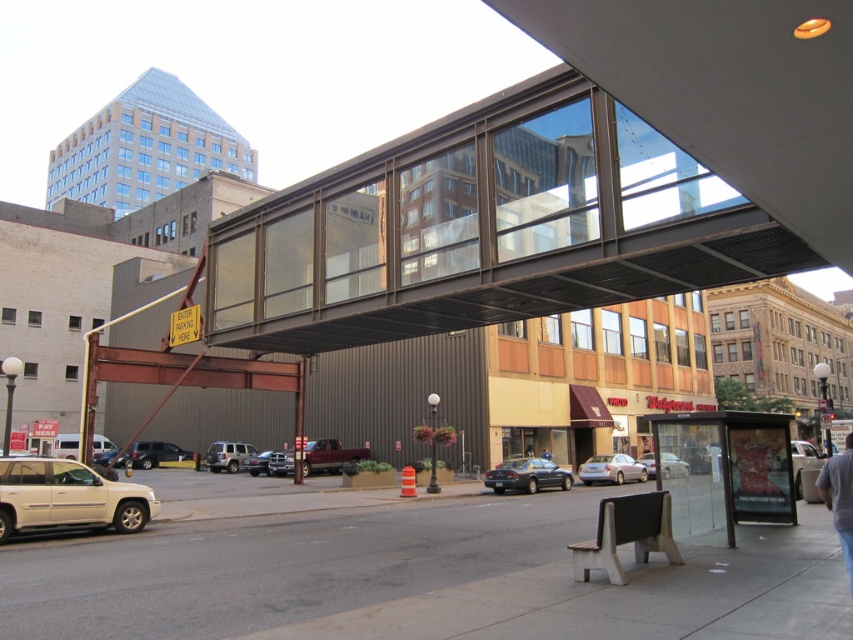
Question: Which point appears farthest from the camera in this image?

Choices:
 (A) (320, 566)
 (B) (103, 460)

Answer: (B)

Question: Which of these objects is positioned farthest from the metallic silver truck at center?

Choices:
 (A) dark blue sedan at center
 (B) matte black suv at lower left
 (C) matte white suv at lower left

Answer: (C)

Question: Is matte red truck at center bigger than blue denim jeans at lower right?

Choices:
 (A) no
 (B) yes

Answer: (B)

Question: Does gray cotton shirt at lower right have a greater width compared to metallic silver sedan at center?

Choices:
 (A) no
 (B) yes

Answer: (B)

Question: Can you confirm if gray cotton shirt at lower right is smaller than matte black suv at lower left?

Choices:
 (A) no
 (B) yes

Answer: (A)

Question: Which object is positioned closest to the metallic silver sedan at center?

Choices:
 (A) matte black suv at lower left
 (B) matte silver suv at center

Answer: (B)